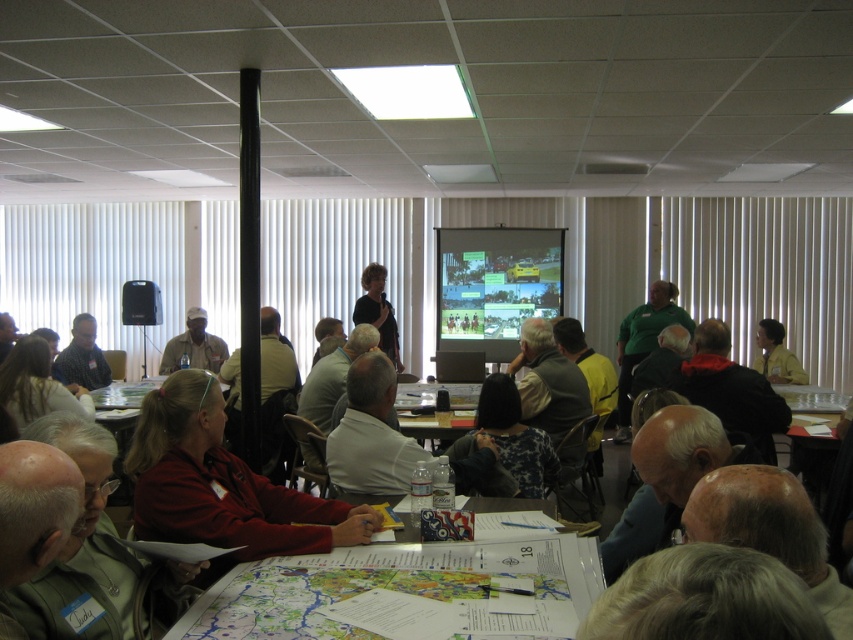
You are a participant in the conference room and want to see both the white paper map at lower center and the matte plastic projector screen at center clearly. Which object is closer to you, the participant, so you can focus on it first?

The white paper map at lower center is closer to you because it is in front of the matte plastic projector screen at center.

You are organizing a presentation and need to display a detailed map for the audience. Given the white paper map at lower center and the matte plastic projector screen at center, which one would be more suitable for a large audience to see clearly?

The matte plastic projector screen at center is more suitable for a large audience to see clearly because it is larger than the white paper map at lower center.